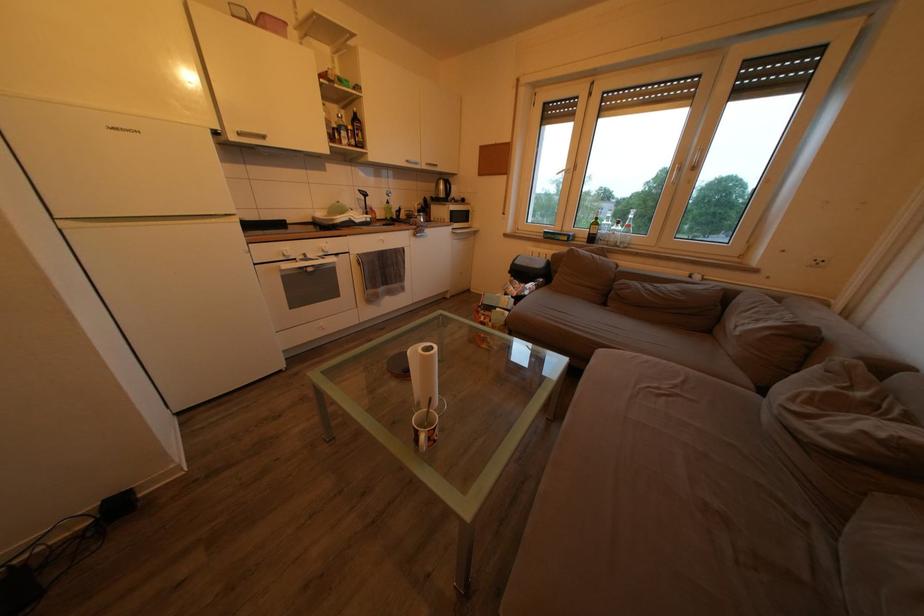
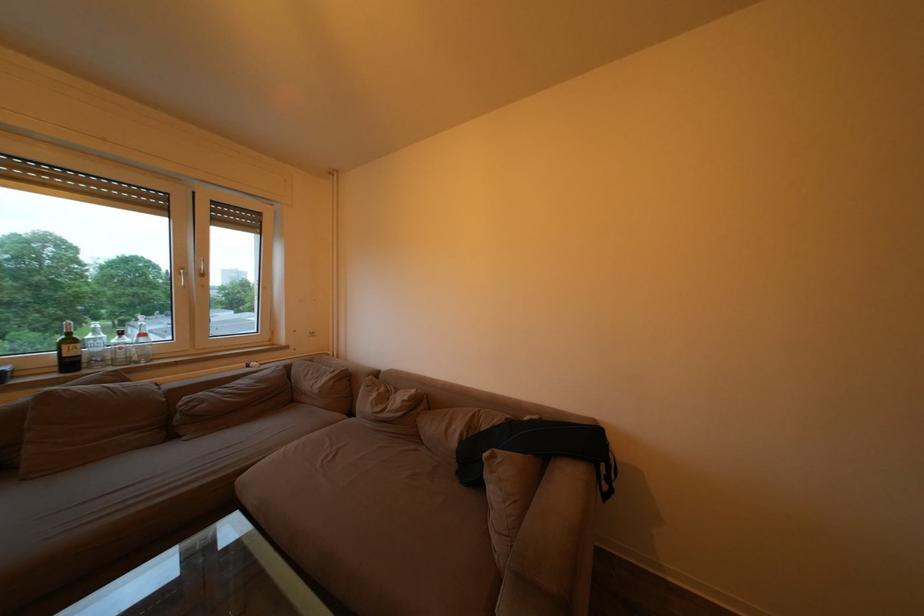
Find the pixel in the second image that matches (x=613, y=238) in the first image.

(107, 355)